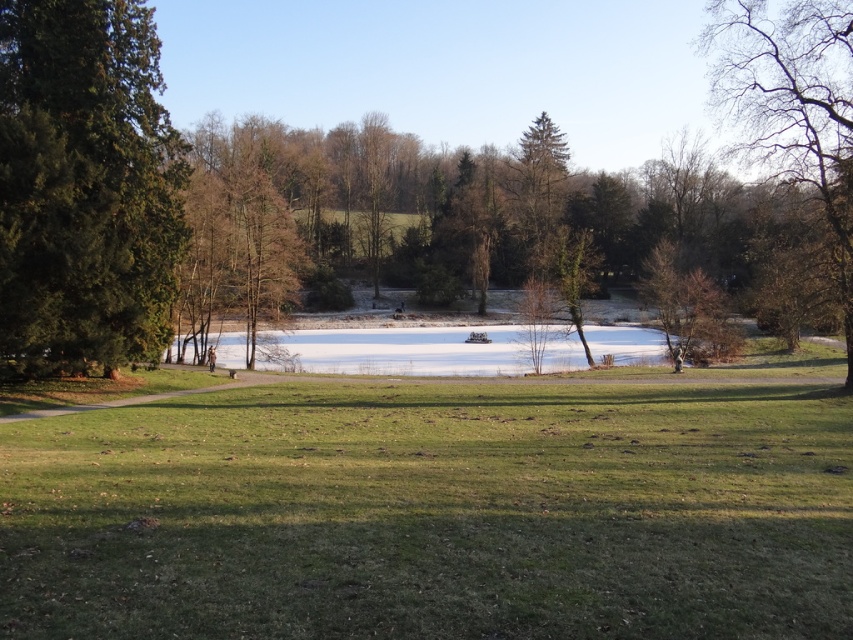
You are a park visitor who wants to take a photo of the green textured tree at left and the bare branches at upper right. Which tree should you move closer to in order to capture both in a single frame?

You should move closer to the green textured tree at left because it is smaller than the bare branches at upper right, allowing both to fit within the camera frame more easily.

You are standing at the center of the paved pathway in the park. Looking towards the frozen lake, you notice a specific point marked at coordinates (85,188). What object is located at this point?

The point at coordinates (85,188) corresponds to a green textured tree at left.